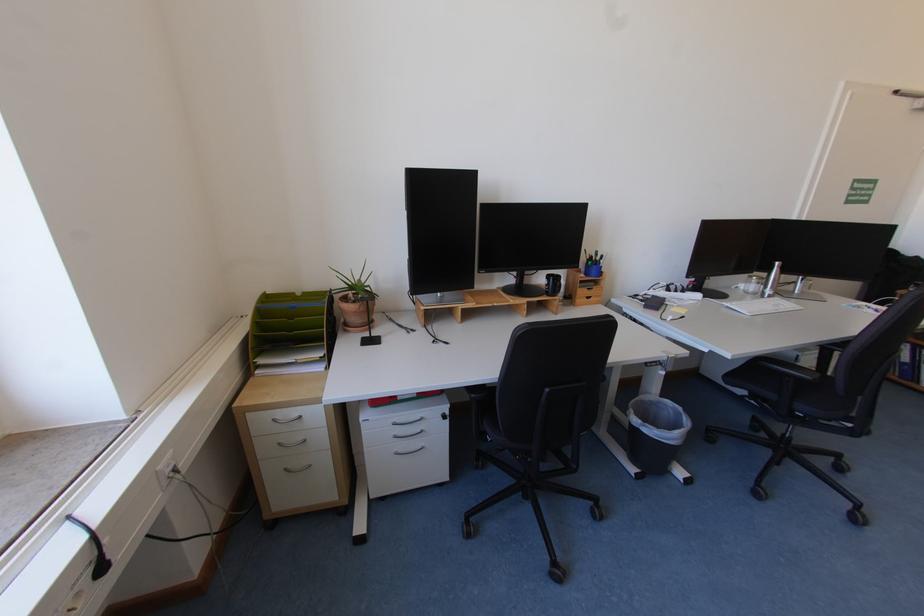
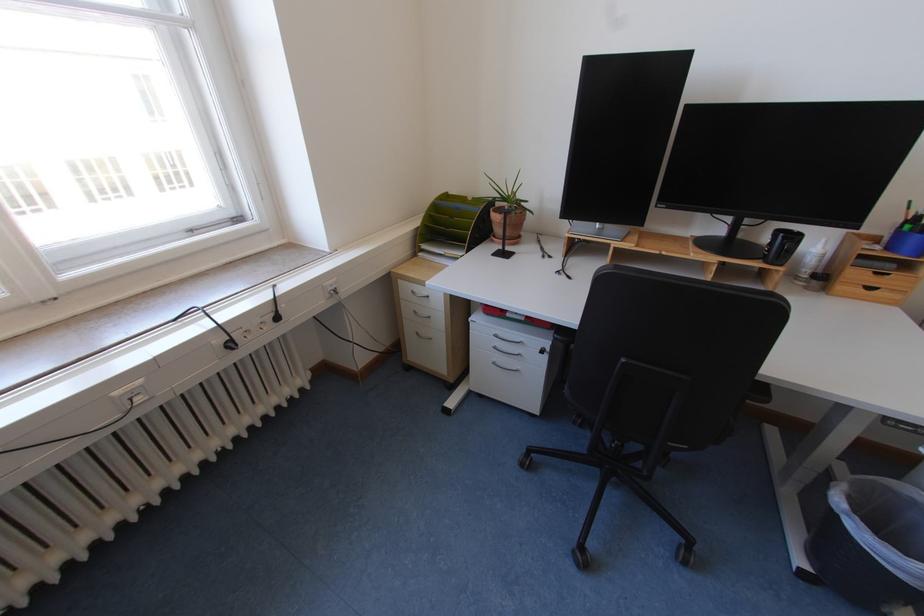
Where in the second image is the point corresponding to the point at 403,424 from the first image?

(504, 337)